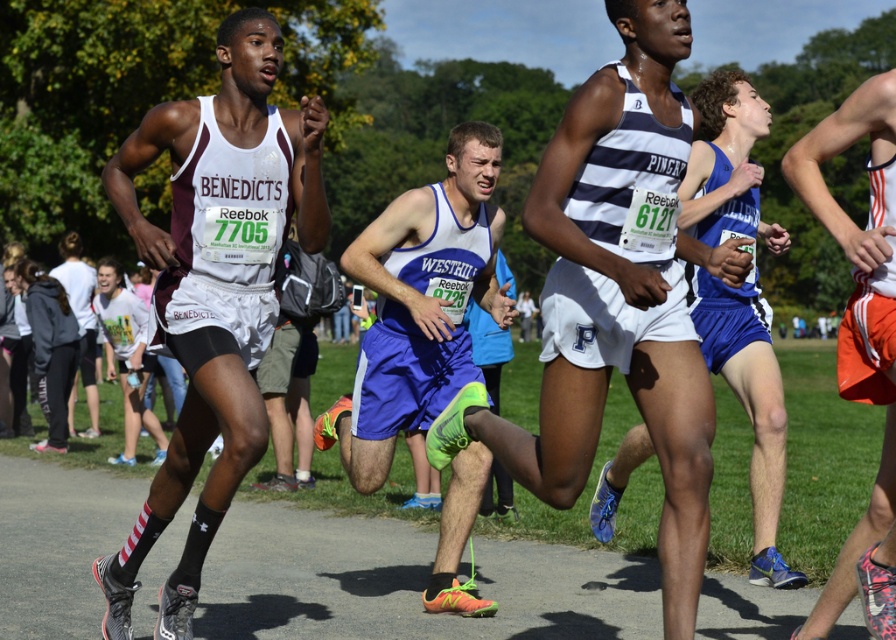
Question: From the image, what is the correct spatial relationship of white striped tank top at center in relation to white matte t-shirt at lower left?

Choices:
 (A) below
 (B) above

Answer: (B)

Question: Among these points, which one is farthest from the camera?

Choices:
 (A) pos(811,136)
 (B) pos(378,314)
 (C) pos(108,330)
 (D) pos(590,464)

Answer: (C)

Question: Can you confirm if white striped tank top at center is bigger than orange fabric shorts at right?

Choices:
 (A) no
 (B) yes

Answer: (B)

Question: Among these objects, which one is nearest to the camera?

Choices:
 (A) white matte t-shirt at lower left
 (B) blue jersey at center
 (C) maroon jersey at center

Answer: (C)

Question: Which point appears closest to the camera in this image?

Choices:
 (A) (717, 177)
 (B) (201, 509)

Answer: (B)

Question: Can you confirm if blue fabric shorts at center is smaller than blue jersey at center?

Choices:
 (A) no
 (B) yes

Answer: (A)